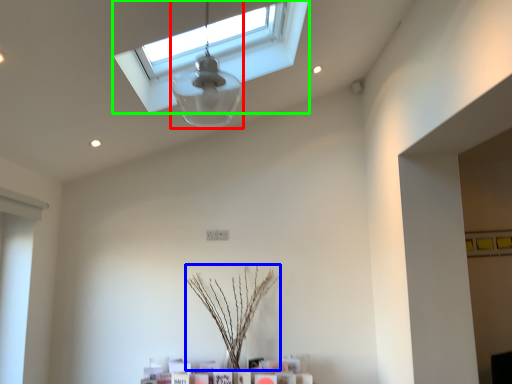
Question: Which object is positioned farthest from lamp (highlighted by a red box)? Select from plant (highlighted by a blue box) and window (highlighted by a green box).

Choices:
 (A) plant
 (B) window

Answer: (A)